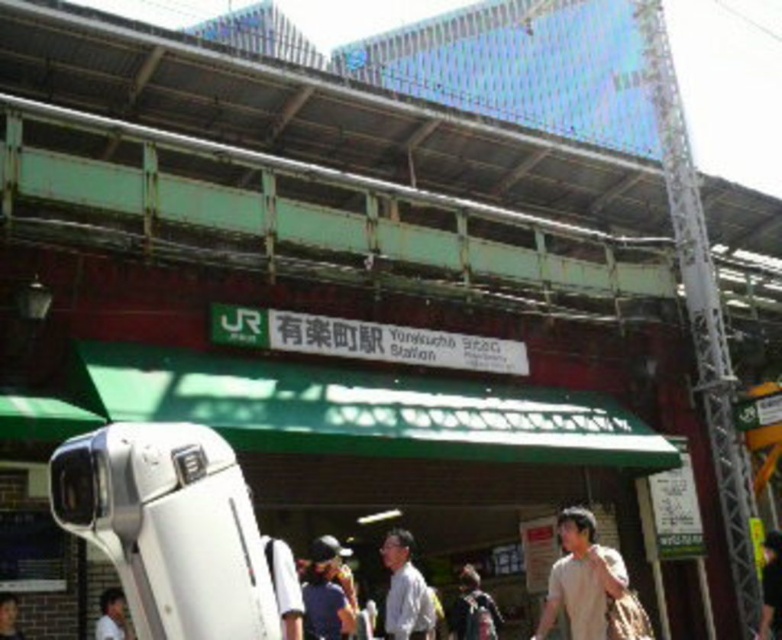
Does point (350, 625) lie in front of point (101, 625)?

That is False.

The height and width of the screenshot is (640, 782). Describe the element at coordinates (325, 593) in the screenshot. I see `blue fabric shirt at lower center` at that location.

Where is `blue fabric shirt at lower center`? blue fabric shirt at lower center is located at coordinates (325, 593).

Can you confirm if white matte shirt at center is positioned below light brown hair at lower right?

Yes.

Measure the distance between white matte shirt at center and light brown hair at lower right.

white matte shirt at center and light brown hair at lower right are 11.32 meters apart from each other.

Identify the location of white matte shirt at center. (404, 592).

The height and width of the screenshot is (640, 782). In order to click on white matte shirt at center in this screenshot , I will do `click(404, 592)`.

Is white matte shirt at center positioned before light brown hair at lower left?

No.

Between white matte shirt at center and light brown hair at lower left, which one is positioned higher?

Positioned higher is light brown hair at lower left.

Is point (407, 538) behind point (106, 620)?

That is True.

The height and width of the screenshot is (640, 782). Find the location of `white matte shirt at center`. white matte shirt at center is located at coordinates (404, 592).